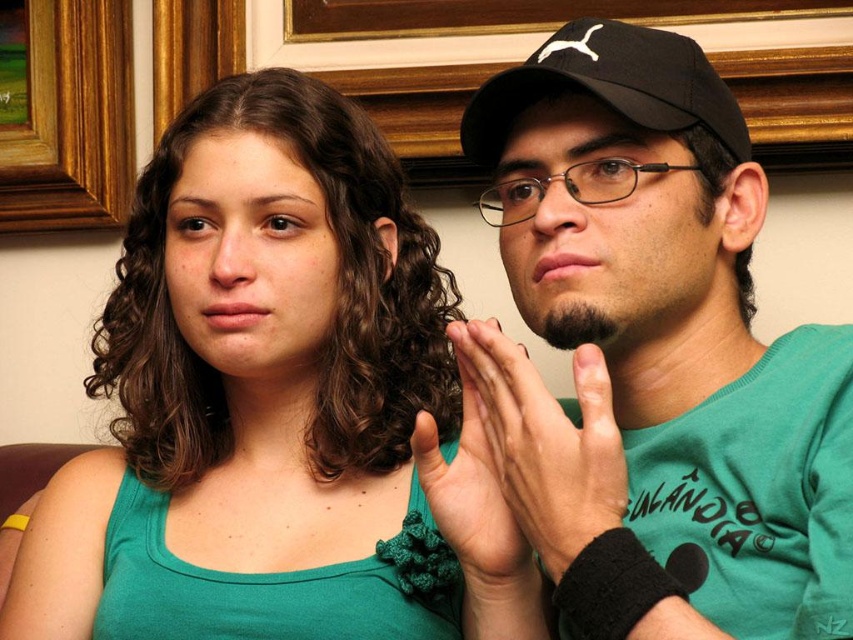
Question: Among these points, which one is nearest to the camera?

Choices:
 (A) (473, 390)
 (B) (642, 81)
 (C) (294, 300)
 (D) (65, 170)

Answer: (A)

Question: Is green fabric tank top at center smaller than brown wooden picture frame at upper left?

Choices:
 (A) yes
 (B) no

Answer: (B)

Question: Which of the following is the closest to the observer?

Choices:
 (A) green fabric tank top at center
 (B) black matte cap at upper center
 (C) matte green fabric at center
 (D) black fabric baseball cap at upper center

Answer: (B)

Question: Which point is closer to the camera taking this photo?

Choices:
 (A) (788, 404)
 (B) (590, 516)

Answer: (B)

Question: Where is green fabric tank top at center located in relation to brown wooden picture frame at upper left in the image?

Choices:
 (A) below
 (B) above

Answer: (A)

Question: Does green fabric tank top at center have a greater width compared to black fabric baseball cap at upper center?

Choices:
 (A) yes
 (B) no

Answer: (A)